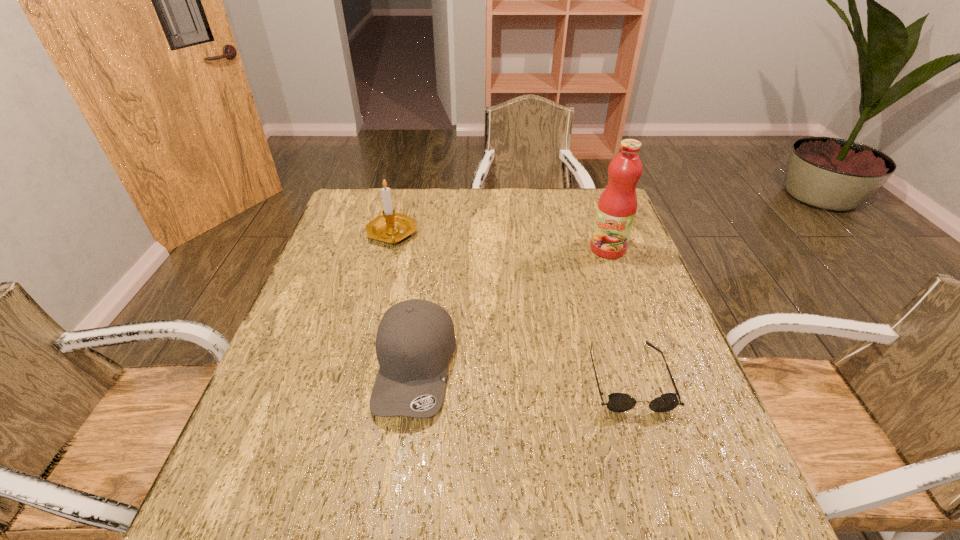
At what (x,y) coordinates should I click in order to perform the action: click on free space between the second tallest object and the shortest object. Please return your answer as a coordinate pair (x, y). The height and width of the screenshot is (540, 960). Looking at the image, I should click on (510, 306).

The image size is (960, 540). Identify the location of vacant space that is in between the tallest object and the third tallest object. (512, 308).

You are a GUI agent. You are given a task and a screenshot of the screen. Output one action in this format:
    pyautogui.click(x=<x>, y=<y>)
    Task: Click on the free space between the fruit juice and the third shortest object
    
    Given the screenshot: What is the action you would take?
    pyautogui.click(x=500, y=242)

This screenshot has width=960, height=540. I want to click on object that stands as the second closest to the fruit juice, so click(x=415, y=340).

Point out which object is positioned as the third nearest to the baseball cap. Please provide its 2D coordinates. Your answer should be formatted as a tuple, i.e. [(x, y)], where the tuple contains the x and y coordinates of a point satisfying the conditions above.

[(617, 205)]